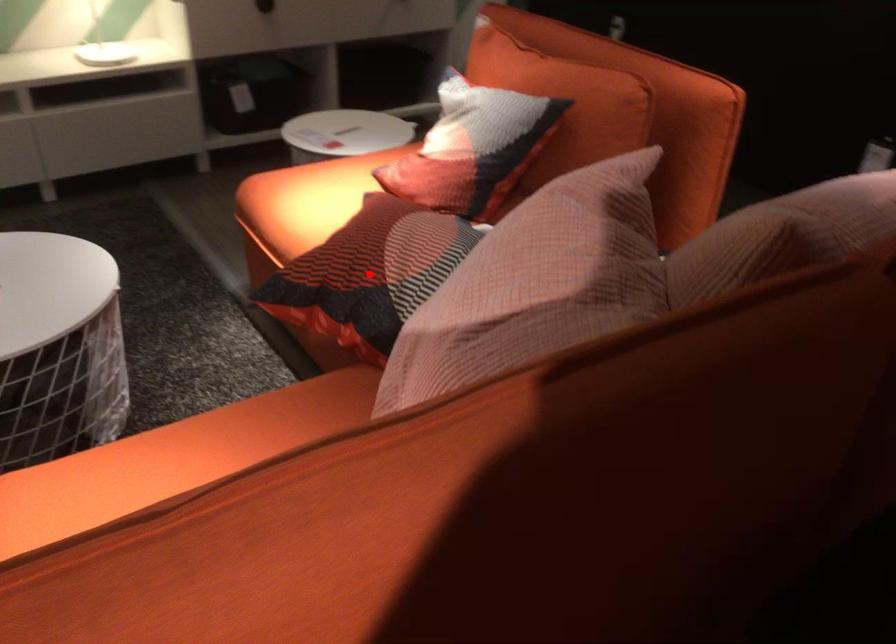
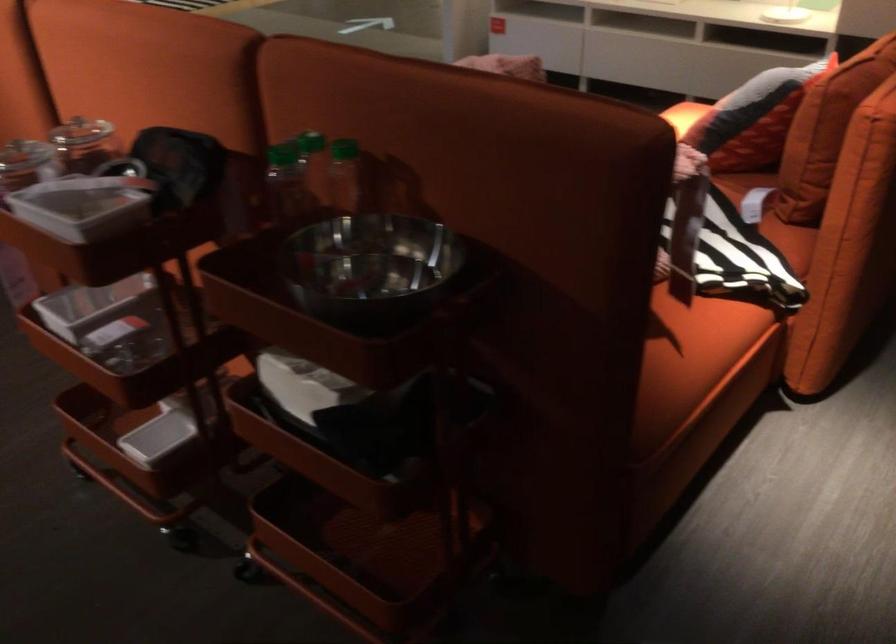
Question: I am providing you with two images of the same scene from different viewpoints. A red point is marked on the first image. At the location where the point appears in image 1, is it still visible in image 2?

Choices:
 (A) Yes
 (B) No

Answer: (B)